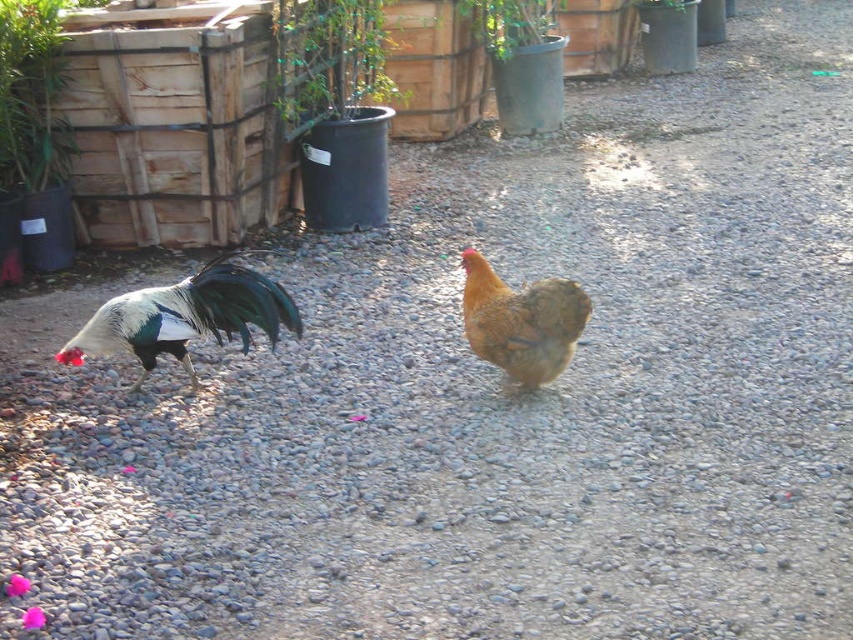
You are a farmer checking the chicken coop and notice the brown feathered chicken at center and the green matte pot at upper center. Which object is larger in size?

The brown feathered chicken at center is smaller than the green matte pot at upper center, so the green matte pot at upper center is larger in size.